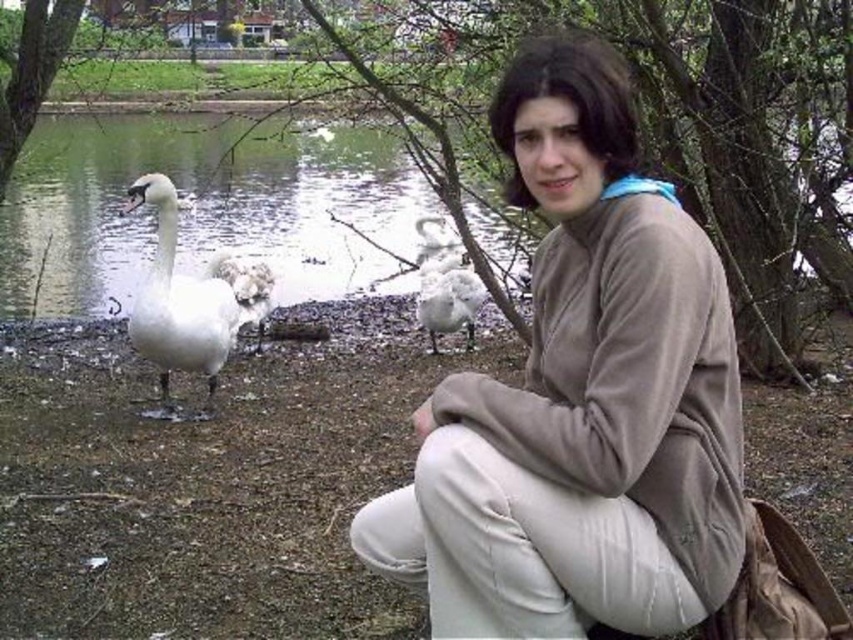
Based on the photo, you are a photographer trying to capture the matte brown sweater at center in your shot. What coordinates should you aim for to ensure the sweater is centered in your viewfinder?

To center the matte brown sweater at center in your viewfinder, aim for the coordinates at point (581, 397).